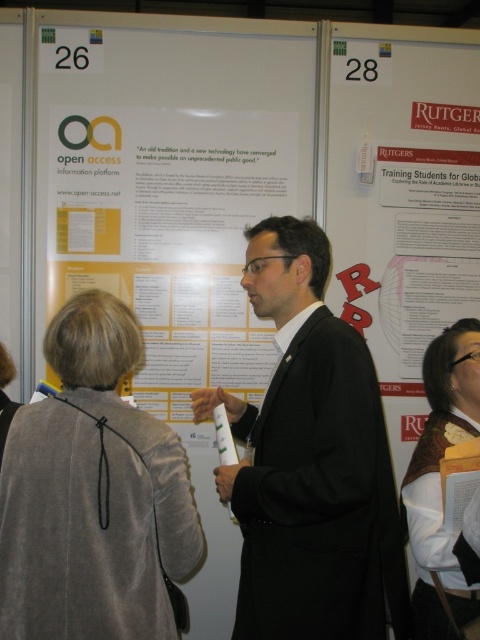
You are standing in front of the posters displayed at the conference. There are two points marked on the wall, one at coordinate point (x=84, y=296) and another at point (x=478, y=364). Which point is closer to you?

Point (x=84, y=296) is in front of point (x=478, y=364), so it is closer to you.

In the scene shown: A person wearing a black matte suit at center wants to move to the poster titled

The distance between the black matte suit at center and the poster titled

What is the 2D coordinate of the velvet gray blazer at center?

The velvet gray blazer at center is located at the 2D coordinate point of (93, 493).